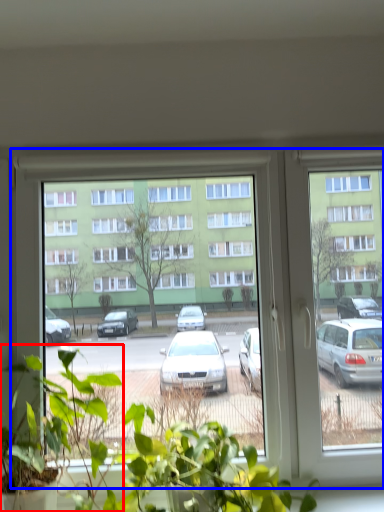
Question: Among these objects, which one is nearest to the camera, houseplant (highlighted by a red box) or window (highlighted by a blue box)?

Choices:
 (A) houseplant
 (B) window

Answer: (A)